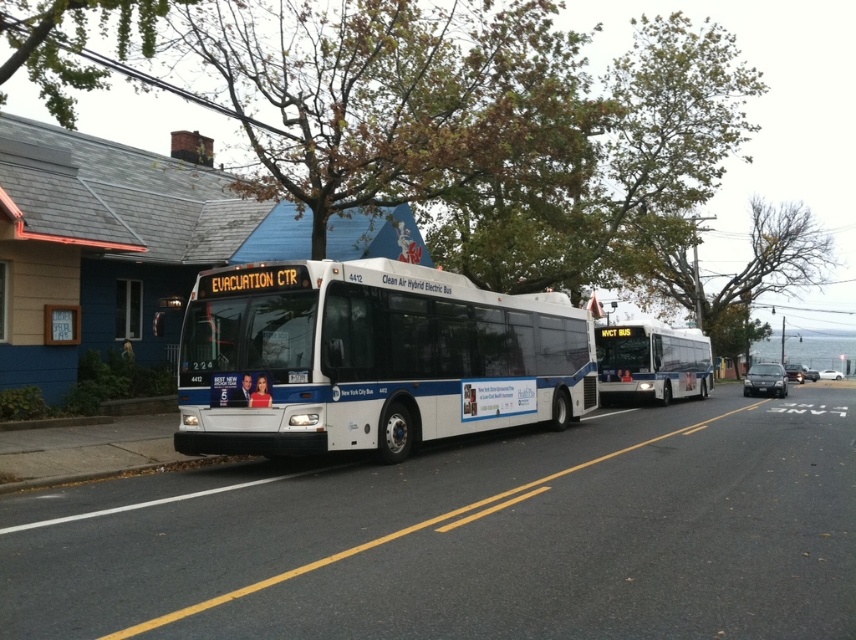
You are a pedestrian standing on the sidewalk and see the green leafy tree at upper center and the white matte bus at center. Which object is higher from the ground?

The green leafy tree at upper center is positioned over the white matte bus at center, so it is higher from the ground.

You are standing on the sidewalk next to the road and see two points marked on the image. The first point is at coordinate point (726, 305) and the second point is at coordinate point (100, 88). Which point is closer to you?

Point (100, 88) is closer to you because it is not as far away as point (726, 305), which is further away from the camera.

You are a pedestrian standing on the sidewalk and looking up at the trees above the road. Which tree is closer to you between the bare branches at upper center and the green leafy tree at upper center?

The bare branches at upper center is closer to you because it is positioned under the green leafy tree at upper center, meaning it is in front of the other tree.